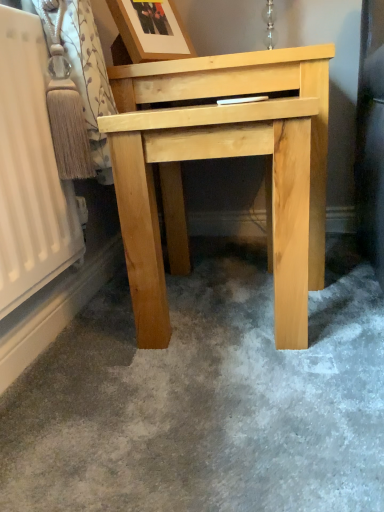
Question: From a real-world perspective, is wooden picture frame at upper center above or below natural wood table at center?

Choices:
 (A) above
 (B) below

Answer: (A)

Question: Based on their positions, is wooden picture frame at upper center located to the left or right of natural wood table at center?

Choices:
 (A) right
 (B) left

Answer: (B)

Question: From the image's perspective, is wooden picture frame at upper center above or below natural wood table at center?

Choices:
 (A) above
 (B) below

Answer: (A)

Question: Is point (127, 252) closer or farther from the camera than point (183, 46)?

Choices:
 (A) closer
 (B) farther

Answer: (A)

Question: Is natural wood table at center wider or thinner than wooden picture frame at upper center?

Choices:
 (A) thin
 (B) wide

Answer: (B)

Question: From the image's perspective, is natural wood table at center positioned above or below wooden picture frame at upper center?

Choices:
 (A) below
 (B) above

Answer: (A)

Question: From a real-world perspective, is natural wood table at center positioned above or below wooden picture frame at upper center?

Choices:
 (A) below
 (B) above

Answer: (A)